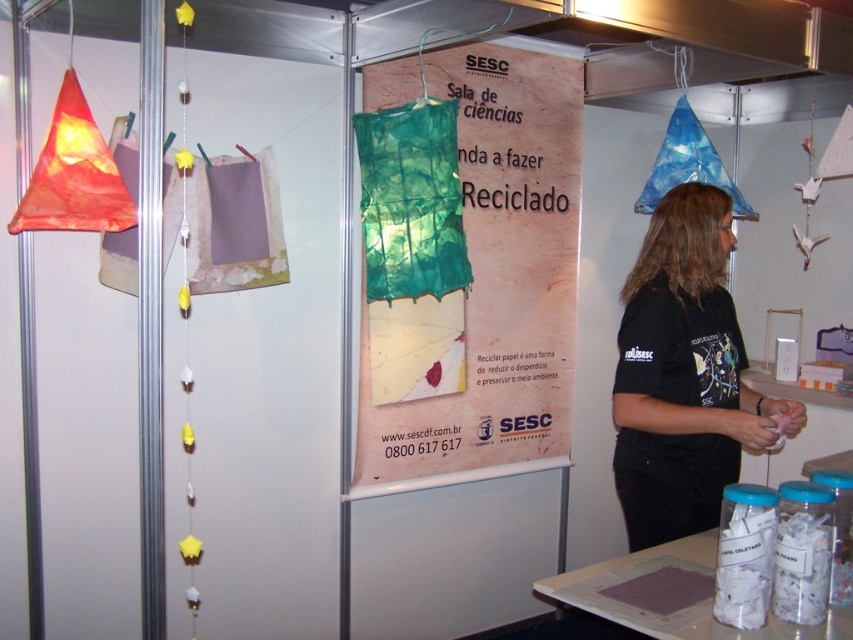
Between point (469, 381) and point (718, 276), which one is positioned in front?

Positioned in front is point (718, 276).

Between green fabric lampshade at center and black matte shirt at right, which one appears on the left side from the viewer's perspective?

From the viewer's perspective, green fabric lampshade at center appears more on the left side.

Where is `green fabric lampshade at center`? Image resolution: width=853 pixels, height=640 pixels. green fabric lampshade at center is located at coordinates (485, 284).

This screenshot has width=853, height=640. I want to click on green fabric lampshade at center, so click(x=485, y=284).